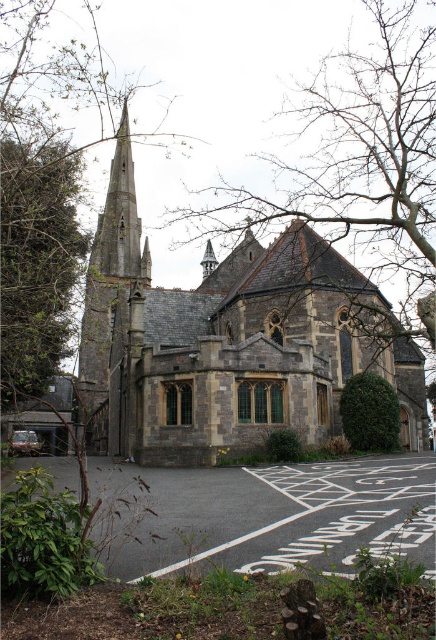
Question: Which point appears closest to the camera in this image?

Choices:
 (A) [x=208, y=252]
 (B) [x=27, y=76]

Answer: (B)

Question: Can you confirm if green leafy tree at left is positioned to the left of dark gray stone steeple at center-left?

Choices:
 (A) yes
 (B) no

Answer: (A)

Question: Is the position of gray asphalt parking lot at lower center less distant than that of dark gray stone steeple at center-left?

Choices:
 (A) no
 (B) yes

Answer: (B)

Question: Can you confirm if gray asphalt parking lot at lower center is positioned to the left of green leafy tree at left?

Choices:
 (A) yes
 (B) no

Answer: (B)

Question: Which point appears farthest from the camera in this image?

Choices:
 (A) coord(385,477)
 (B) coord(29,163)
 (C) coord(132,445)

Answer: (C)

Question: Which of the following is the closest to the observer?

Choices:
 (A) green leafy tree at left
 (B) gray asphalt parking lot at lower center
 (C) dark gray stone steeple at center-left
 (D) stone church at center

Answer: (B)